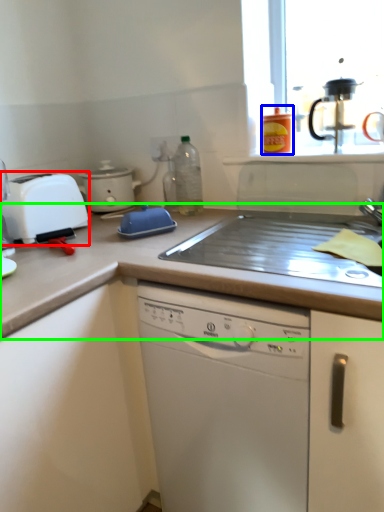
Question: Estimate the real-world distances between objects in this image. Which object is farther from toaster (highlighted by a red box), kitchen appliance (highlighted by a blue box) or countertop (highlighted by a green box)?

Choices:
 (A) kitchen appliance
 (B) countertop

Answer: (A)